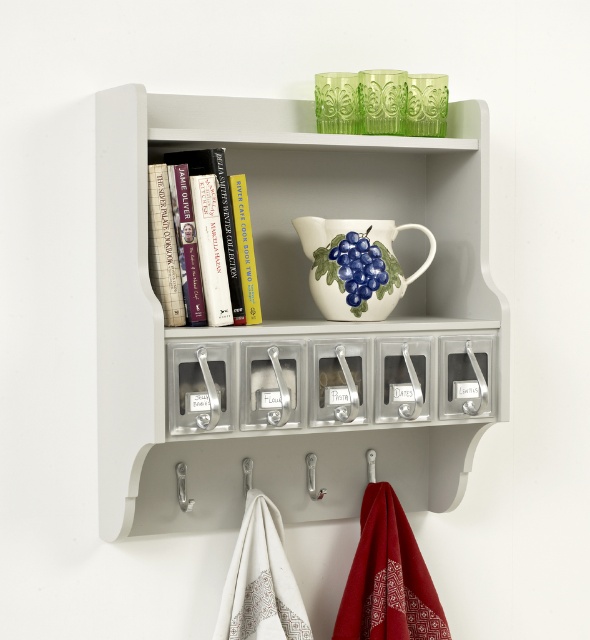
You are standing in front of the wall shelf and want to hang a small bag on the closest object to you. Which object should you choose between the white ceramic jug at upper center and the silver metallic hook at lower left?

The silver metallic hook at lower left is closer to the viewer than the white ceramic jug at upper center, so you should hang the bag on the silver metallic hook at lower left.

You are standing in front of the wall mounted shelf unit. There is a white ceramic jug at upper center. Can you tell me where the point with coordinates [355,266] is located?

The point with coordinates [355,266] is located on the white ceramic jug at upper center.